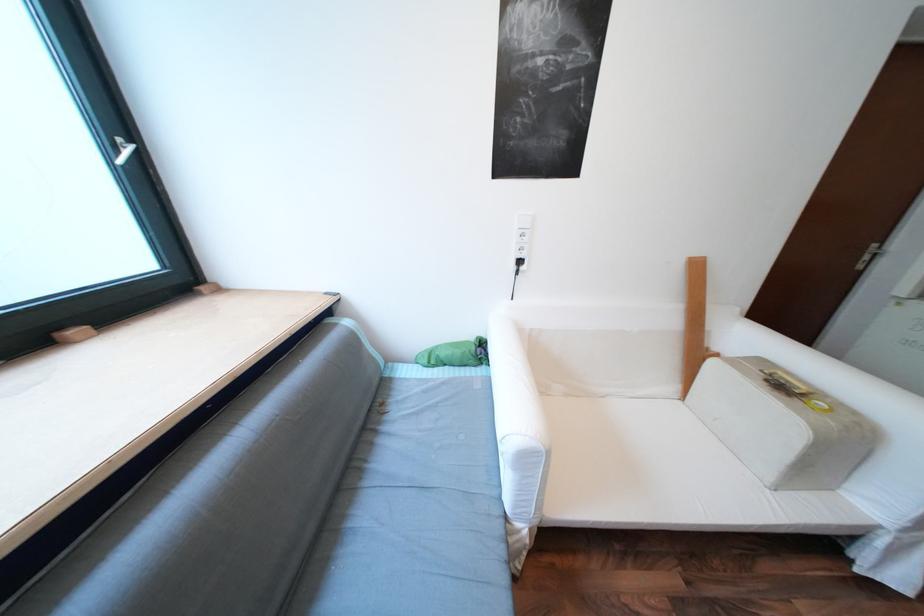
This screenshot has height=616, width=924. Identify the location of small white case. (780, 424).